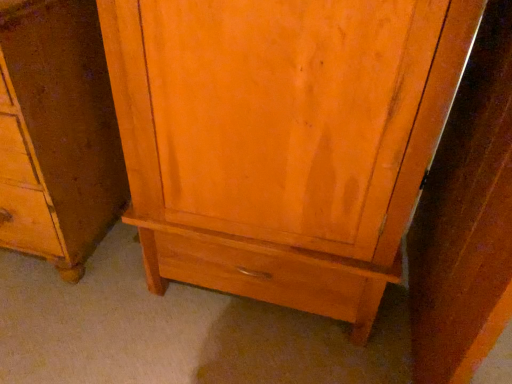
Question: In the image, is matte wood cabinet at center on the left side or the right side of matte wood cupboard at center?

Choices:
 (A) right
 (B) left

Answer: (B)

Question: Is matte wood cabinet at center in front of or behind matte wood cupboard at center in the image?

Choices:
 (A) behind
 (B) front

Answer: (A)

Question: From a real-world perspective, is matte wood cabinet at center above or below matte wood cupboard at center?

Choices:
 (A) below
 (B) above

Answer: (A)

Question: Is matte wood cupboard at center bigger or smaller than matte wood cabinet at center?

Choices:
 (A) small
 (B) big

Answer: (B)

Question: In terms of height, does matte wood cupboard at center look taller or shorter compared to matte wood cabinet at center?

Choices:
 (A) tall
 (B) short

Answer: (A)

Question: Considering the positions of matte wood cupboard at center and matte wood cabinet at center in the image, is matte wood cupboard at center wider or thinner than matte wood cabinet at center?

Choices:
 (A) thin
 (B) wide

Answer: (B)

Question: From the image's perspective, is matte wood cupboard at center positioned above or below matte wood cabinet at center?

Choices:
 (A) above
 (B) below

Answer: (B)